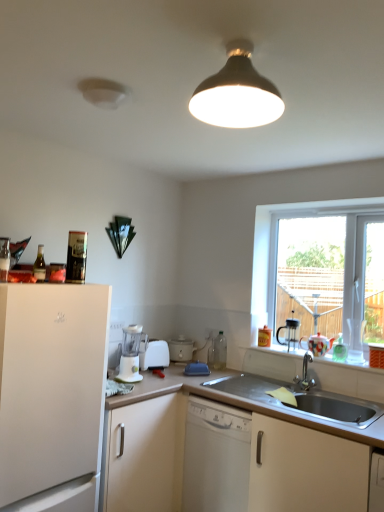
Image resolution: width=384 pixels, height=512 pixels. I want to click on white matte dishwasher at center, so click(x=216, y=457).

Where is `black plastic coffee machine at right, the 1th coffee machine from the right`? Image resolution: width=384 pixels, height=512 pixels. black plastic coffee machine at right, the 1th coffee machine from the right is located at coordinates (289, 333).

Identify the location of porcelain ceramic cups at lower right. This screenshot has width=384, height=512. (272, 360).

Find the location of a particular element. This screenshot has height=512, width=384. white plastic toaster at center, the first appliance positioned from the front is located at coordinates (154, 355).

The image size is (384, 512). Describe the element at coordinates (154, 355) in the screenshot. I see `white plastic toaster at center, the first appliance positioned from the front` at that location.

What do you see at coordinates (131, 354) in the screenshot? I see `white plastic coffee machine at lower center, the 2th coffee machine when ordered from back to front` at bounding box center [131, 354].

The width and height of the screenshot is (384, 512). I want to click on stainless steel sink at lower right, so click(296, 394).

In the scene shown: Relative to white matte refrigerator at left, arranged as the second cabinetry when viewed from the right, is white plastic coffee machine at lower center, the 2th coffee machine when ordered from back to front, in front or behind?

In the image, white plastic coffee machine at lower center, the 2th coffee machine when ordered from back to front, appears behind white matte refrigerator at left, arranged as the second cabinetry when viewed from the right.

Which object is positioned more to the right, white plastic coffee machine at lower center, the 1th coffee machine in the front-to-back sequence, or white matte refrigerator at left, arranged as the second cabinetry when viewed from the right?

white plastic coffee machine at lower center, the 1th coffee machine in the front-to-back sequence, is more to the right.

From the image's perspective, is matte white slow cooker at center, marked as the second appliance in a left-to-right arrangement, above white matte cabinet at lower center, the first cabinetry when ordered from right to left?

Yes, from the image's perspective, matte white slow cooker at center, marked as the second appliance in a left-to-right arrangement, is over white matte cabinet at lower center, the first cabinetry when ordered from right to left.

Which of these two, matte white slow cooker at center, acting as the second appliance starting from the front, or white matte cabinet at lower center, the first cabinetry when ordered from right to left, is bigger?

white matte cabinet at lower center, the first cabinetry when ordered from right to left.

The image size is (384, 512). I want to click on cabinetry that is the 1st one when counting forward from the matte white slow cooker at center, acting as the second appliance starting from the front, so click(x=236, y=447).

In the scene shown: Measure the distance between matte white slow cooker at center, which is the 1th appliance from right to left, and white matte cabinet at lower center, which is counted as the second cabinetry, starting from the left.

matte white slow cooker at center, which is the 1th appliance from right to left, and white matte cabinet at lower center, which is counted as the second cabinetry, starting from the left, are 1.00 meters apart from each other.

From a real-world perspective, does porcelain ceramic cups at lower right sit lower than clear glass window at right?

Yes, from a real-world perspective, porcelain ceramic cups at lower right is beneath clear glass window at right.

Considering the relative sizes of porcelain ceramic cups at lower right and clear glass window at right in the image provided, is porcelain ceramic cups at lower right smaller than clear glass window at right?

Correct, porcelain ceramic cups at lower right occupies less space than clear glass window at right.

Considering the sizes of porcelain ceramic cups at lower right and clear glass window at right in the image, is porcelain ceramic cups at lower right taller or shorter than clear glass window at right?

porcelain ceramic cups at lower right is shorter than clear glass window at right.

In the scene shown: How many degrees apart are the facing directions of black plastic coffee machine at right, the 2th coffee machine positioned from the left, and white plastic toaster at center, the first appliance positioned from the front?

88.8 degrees.

From the image's perspective, is black plastic coffee machine at right, which appears as the first coffee machine when viewed from the back, located beneath white plastic toaster at center, the first appliance positioned from the front?

Actually, black plastic coffee machine at right, which appears as the first coffee machine when viewed from the back, appears above white plastic toaster at center, the first appliance positioned from the front, in the image.

Is the position of black plastic coffee machine at right, the 1th coffee machine from the right, less distant than that of white plastic toaster at center, which is counted as the 2th appliance, starting from the back?

Yes.

From the picture: Considering the relative positions of white plastic coffee machine at lower center, the 1th coffee machine in the front-to-back sequence, and matte white slow cooker at center, which is the 1th appliance from right to left, in the image provided, is white plastic coffee machine at lower center, the 1th coffee machine in the front-to-back sequence, to the right of matte white slow cooker at center, which is the 1th appliance from right to left, from the viewer's perspective?

Incorrect, white plastic coffee machine at lower center, the 1th coffee machine in the front-to-back sequence, is not on the right side of matte white slow cooker at center, which is the 1th appliance from right to left.

Does white plastic coffee machine at lower center, which is counted as the second coffee machine, starting from the right, have a lesser height compared to matte white slow cooker at center, marked as the second appliance in a left-to-right arrangement?

In fact, white plastic coffee machine at lower center, which is counted as the second coffee machine, starting from the right, may be taller than matte white slow cooker at center, marked as the second appliance in a left-to-right arrangement.

From the image's perspective, between white plastic coffee machine at lower center, the first coffee machine viewed from the left, and matte white slow cooker at center, the first appliance viewed from the back, which one is located above?

white plastic coffee machine at lower center, the first coffee machine viewed from the left, from the image's perspective.

Would you consider white plastic coffee machine at lower center, the first coffee machine viewed from the left, to be distant from matte white slow cooker at center, the first appliance viewed from the back?

They are positioned close to each other.

Are matte white slow cooker at center, which is the 1th appliance from right to left, and clear glass window at right located far from each other?

matte white slow cooker at center, which is the 1th appliance from right to left, is far away from clear glass window at right.

Which is more distant, (187, 344) or (272, 237)?

Point (187, 344)

From the image's perspective, is matte white slow cooker at center, acting as the second appliance starting from the front, above or below clear glass window at right?

From the image's perspective, matte white slow cooker at center, acting as the second appliance starting from the front, appears below clear glass window at right.

Is matte white slow cooker at center, the first appliance viewed from the back, further to camera compared to clear glass window at right?

That is True.

Is clear glass window at right facing towards stainless steel sink at lower right?

No.

Consider the image. Which is correct: clear glass window at right is inside stainless steel sink at lower right, or outside of it?

clear glass window at right is not inside stainless steel sink at lower right, it's outside.

Is point (296, 253) closer to viewer compared to point (315, 410)?

No, (296, 253) is behind (315, 410).

Locate an element on the screen. The height and width of the screenshot is (512, 384). the 1st coffee machine above the white matte refrigerator at left, the first cabinetry when ordered from left to right (from the image's perspective) is located at coordinates (131, 354).

From the matte white slow cooker at center, acting as the second appliance starting from the front, count 1st cabinetrys forward and point to it. Please provide its 2D coordinates.

[(236, 447)]

From the picture: Looking at the image, which one is located closer to white matte dishwasher at center, white matte cabinet at lower center, the first cabinetry when ordered from right to left, or matte white slow cooker at center, which is the 1th appliance from right to left?

white matte cabinet at lower center, the first cabinetry when ordered from right to left.

Looking at the image, which one is located further to white matte refrigerator at left, arranged as the second cabinetry when viewed from the right, white plastic coffee machine at lower center, the first coffee machine viewed from the left, or white plastic toaster at center, the first appliance positioned from the front?

white plastic toaster at center, the first appliance positioned from the front, lies further to white matte refrigerator at left, arranged as the second cabinetry when viewed from the right, than the other object.

From the image, which object appears to be farther from matte black lampshade at upper center, stainless steel sink at lower right or porcelain ceramic cups at lower right?

The object further to matte black lampshade at upper center is porcelain ceramic cups at lower right.

Considering their positions, is white plastic coffee machine at lower center, the 1th coffee machine in the front-to-back sequence, positioned closer to black plastic coffee machine at right, placed as the 2th coffee machine when sorted from front to back, than matte white slow cooker at center, marked as the second appliance in a left-to-right arrangement?

Among the two, matte white slow cooker at center, marked as the second appliance in a left-to-right arrangement, is located nearer to black plastic coffee machine at right, placed as the 2th coffee machine when sorted from front to back.

Looking at the image, which one is located closer to clear glass window at right, black plastic coffee machine at right, the 1th coffee machine from the right, or white plastic toaster at center, the first appliance positioned from the front?

black plastic coffee machine at right, the 1th coffee machine from the right, lies closer to clear glass window at right than the other object.

Based on their spatial positions, is porcelain ceramic cups at lower right or white plastic coffee machine at lower center, the 1th coffee machine in the front-to-back sequence, further from stainless steel sink at lower right?

Based on the image, white plastic coffee machine at lower center, the 1th coffee machine in the front-to-back sequence, appears to be further to stainless steel sink at lower right.

Which object lies further to the anchor point white plastic coffee machine at lower center, the first coffee machine viewed from the left, white plastic toaster at center, the first appliance positioned from the front, or porcelain ceramic cups at lower right?

porcelain ceramic cups at lower right is further to white plastic coffee machine at lower center, the first coffee machine viewed from the left.

Based on their spatial positions, is porcelain ceramic cups at lower right or clear glass window at right closer to matte black lampshade at upper center?

clear glass window at right lies closer to matte black lampshade at upper center than the other object.

Locate an element on the screen. window sill located between matte black lampshade at upper center and black plastic coffee machine at right, the 1th coffee machine from the right, in the depth direction is located at coordinates (272, 360).

The width and height of the screenshot is (384, 512). Identify the location of sink between matte black lampshade at upper center and white matte dishwasher at center in the up-down direction. (296, 394).

Where is `dishwasher between white plastic coffee machine at lower center, the 2th coffee machine when ordered from back to front, and black plastic coffee machine at right, which appears as the first coffee machine when viewed from the back, in the horizontal direction`? Image resolution: width=384 pixels, height=512 pixels. dishwasher between white plastic coffee machine at lower center, the 2th coffee machine when ordered from back to front, and black plastic coffee machine at right, which appears as the first coffee machine when viewed from the back, in the horizontal direction is located at coordinates (216, 457).

I want to click on sink between white plastic coffee machine at lower center, the 1th coffee machine in the front-to-back sequence, and porcelain ceramic cups at lower right, so click(x=296, y=394).